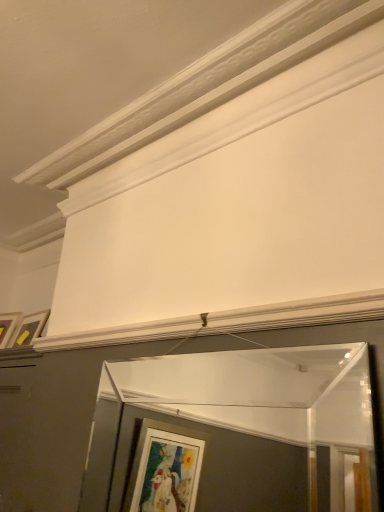
Question: Would you say clear glass mirror at center is to the left or to the right of matte white picture frame at upper left in the picture?

Choices:
 (A) left
 (B) right

Answer: (B)

Question: From the image's perspective, is clear glass mirror at center above or below matte white picture frame at upper left?

Choices:
 (A) above
 (B) below

Answer: (B)

Question: Does point click(249, 478) appear closer or farther from the camera than point click(28, 338)?

Choices:
 (A) closer
 (B) farther

Answer: (B)

Question: From the image's perspective, is matte white picture frame at upper left positioned above or below clear glass mirror at center?

Choices:
 (A) above
 (B) below

Answer: (A)

Question: Considering the positions of point (18, 336) and point (225, 475), is point (18, 336) closer or farther from the camera than point (225, 475)?

Choices:
 (A) closer
 (B) farther

Answer: (A)

Question: Considering the positions of matte white picture frame at upper left and clear glass mirror at center in the image, is matte white picture frame at upper left wider or thinner than clear glass mirror at center?

Choices:
 (A) wide
 (B) thin

Answer: (A)

Question: In terms of size, does matte white picture frame at upper left appear bigger or smaller than clear glass mirror at center?

Choices:
 (A) big
 (B) small

Answer: (B)